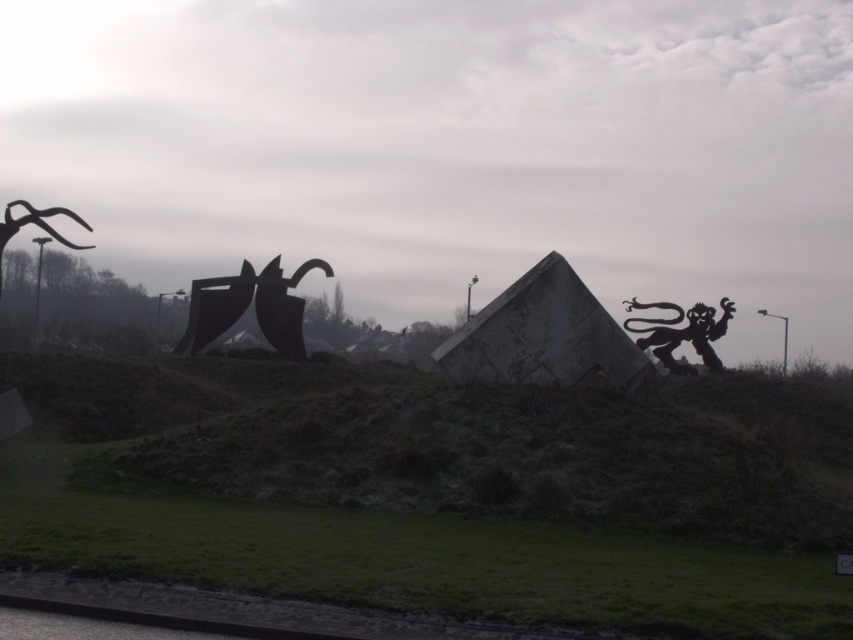
Between green grass at lower center and black matte sculpture at center, which one is positioned higher?

black matte sculpture at center

Who is taller, green grass at lower center or black matte sculpture at center?

black matte sculpture at center is taller.

Measure the distance between green grass at lower center and camera.

green grass at lower center is 8.85 meters from camera.

Where is `green grass at lower center`? This screenshot has width=853, height=640. green grass at lower center is located at coordinates (415, 560).

How far apart are green grass at lower center and dark matte lion at upper right?

green grass at lower center is 28.66 meters away from dark matte lion at upper right.

Find the location of a particular element. The image size is (853, 640). green grass at lower center is located at coordinates (415, 560).

Which is above, black matte sculpture at center or polished metal antlers at left?

polished metal antlers at left is higher up.

Between black matte sculpture at center and polished metal antlers at left, which one appears on the right side from the viewer's perspective?

From the viewer's perspective, black matte sculpture at center appears more on the right side.

You are a GUI agent. You are given a task and a screenshot of the screen. Output one action in this format:
    pyautogui.click(x=<x>, y=<y>)
    Task: Click on the black matte sculpture at center
    
    Given the screenshot: What is the action you would take?
    pyautogui.click(x=247, y=307)